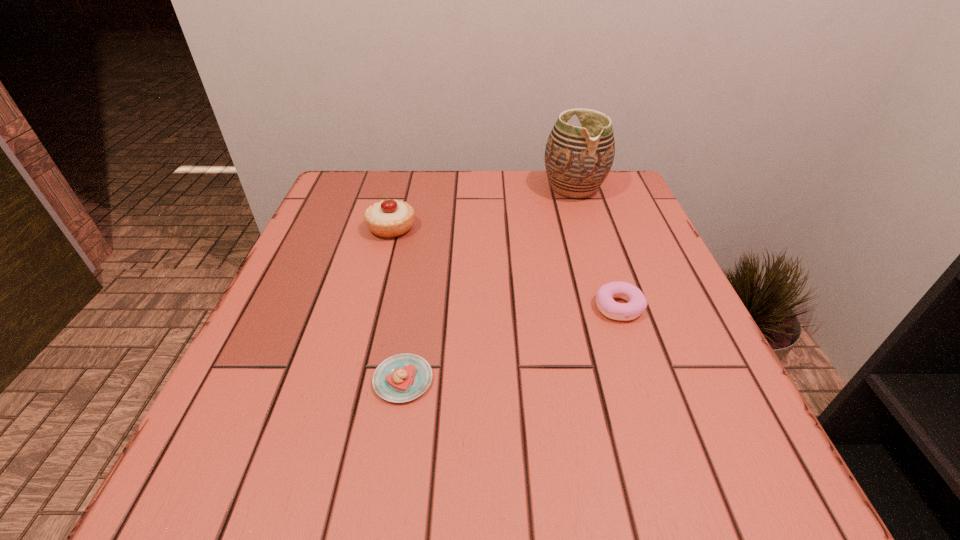
You are a GUI agent. You are given a task and a screenshot of the screen. Output one action in this format:
    pyautogui.click(x=<x>, y=<y>)
    Task: Click on the blank region between the second tallest object and the second nearest object
    This screenshot has width=960, height=540.
    Given the screenshot: What is the action you would take?
    pyautogui.click(x=505, y=267)

This screenshot has width=960, height=540. I want to click on free space between the second shortest object and the second tallest object, so click(505, 267).

Where is `free spot between the tallest object and the third nearest object`? This screenshot has height=540, width=960. free spot between the tallest object and the third nearest object is located at coordinates (483, 208).

Identify the location of object that is the nearest to the nearest pastry. Image resolution: width=960 pixels, height=540 pixels. (637, 303).

Locate an element on the screen. This screenshot has height=540, width=960. object that is the third closest to the second tallest object is located at coordinates (637, 303).

Choose which pastry is the second nearest neighbor to the farthest object. Please provide its 2D coordinates. Your answer should be formatted as a tuple, i.e. [(x, y)], where the tuple contains the x and y coordinates of a point satisfying the conditions above.

[(637, 303)]

Locate which pastry ranks second in proximity to the pottery. Please provide its 2D coordinates. Your answer should be formatted as a tuple, i.e. [(x, y)], where the tuple contains the x and y coordinates of a point satisfying the conditions above.

[(637, 303)]

I want to click on blank area in the image that satisfies the following two spatial constraints: 1. on the back side of the pottery; 2. on the right side of the farthest pastry, so click(x=402, y=188).

I want to click on vacant point that satisfies the following two spatial constraints: 1. on the back side of the shortest pastry; 2. on the left side of the farthest object, so click(433, 188).

The image size is (960, 540). I want to click on free space that satisfies the following two spatial constraints: 1. on the front side of the second nearest object; 2. on the left side of the tallest object, so click(612, 307).